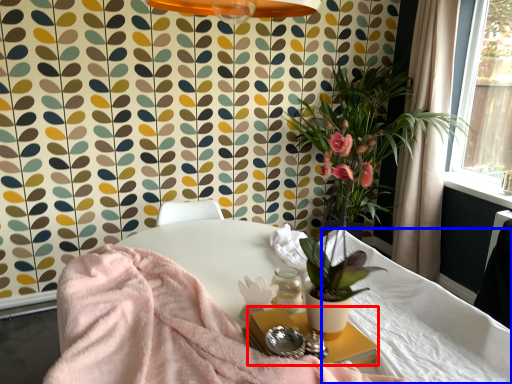
Question: Among these objects, which one is farthest to the camera, side table (highlighted by a red box) or mattress (highlighted by a blue box)?

Choices:
 (A) side table
 (B) mattress

Answer: (B)